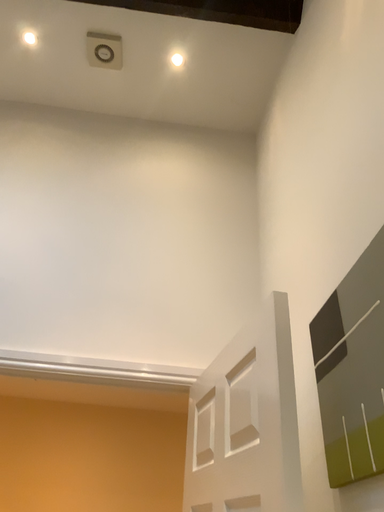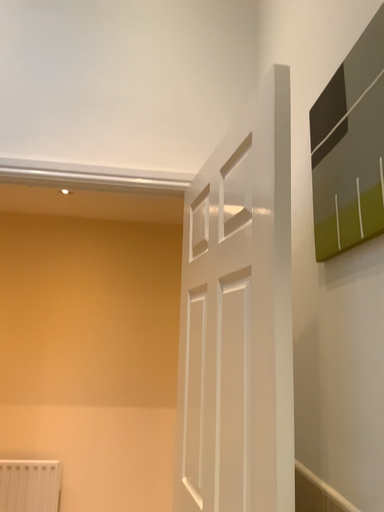
Question: Which way did the camera rotate in the video?

Choices:
 (A) rotated upward
 (B) rotated downward

Answer: (B)